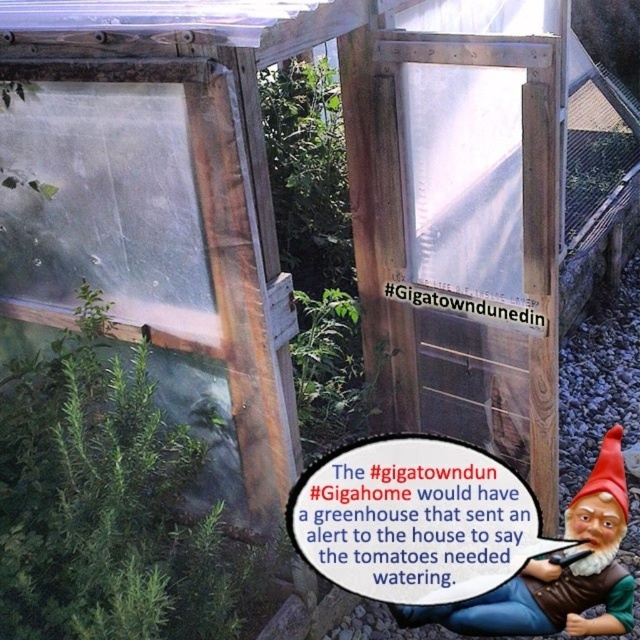
You are a visitor in the greenhouse and want to know which object is taller between the green leafy plant at center and the brown wooden gnome at lower right. Can you tell me?

The green leafy plant at center is taller than the brown wooden gnome at lower right.

You are standing at the entrance of the greenhouse and want to find the green leafy plant at center. Based on the coordinates provided, in which direction should you look to locate it?

The green leafy plant at center is located at point 0.789 on the x axis and 0.170 on the y axis. Since the entrance is at the bottom right corner, you should look towards the upper left direction to locate it.